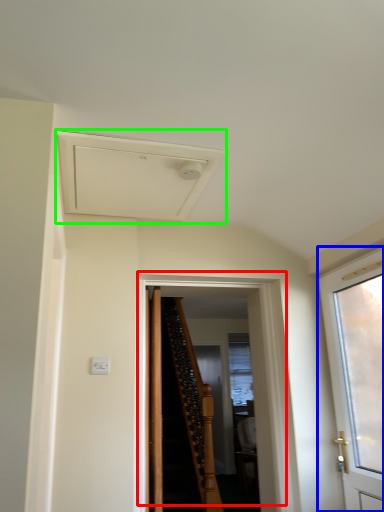
Question: Which object is the farthest from door (highlighted by a red box)? Choose among these: door (highlighted by a blue box) or exhaust hood (highlighted by a green box).

Choices:
 (A) door
 (B) exhaust hood

Answer: (B)